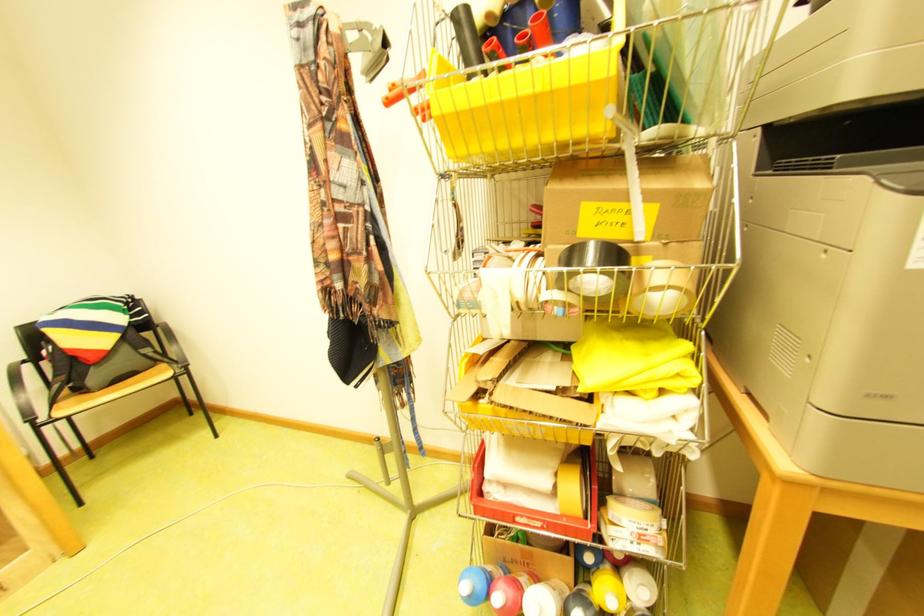
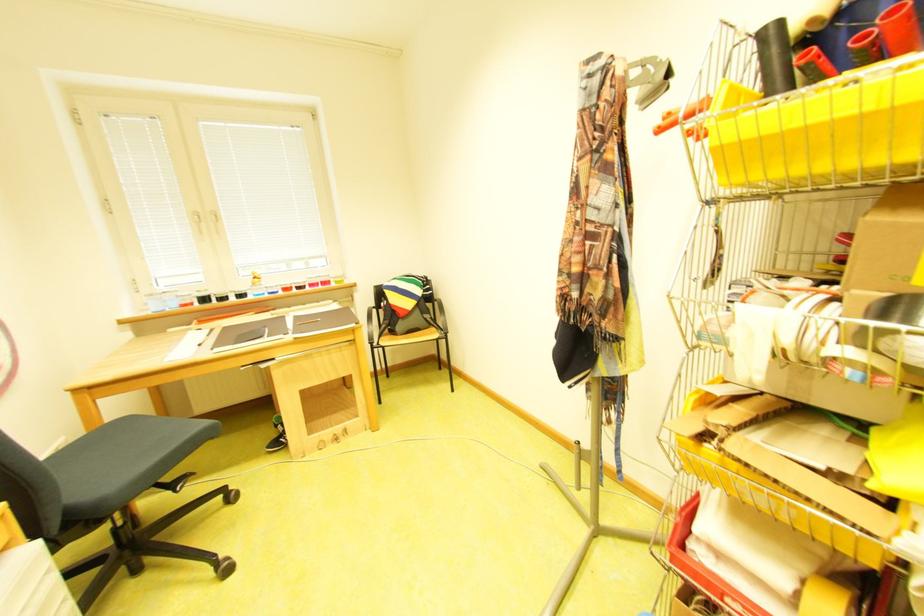
Locate, in the second image, the point that corresponds to (x=52, y=419) in the first image.

(385, 345)